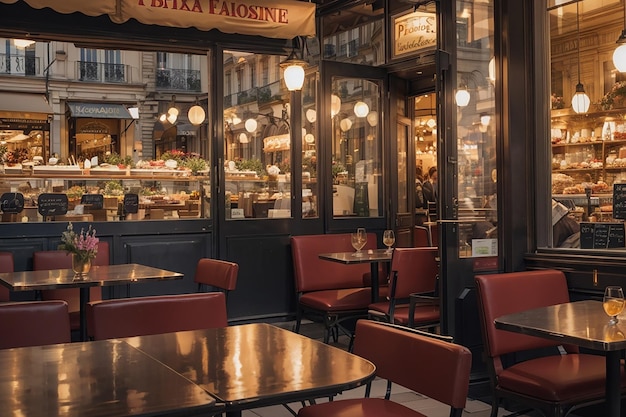
I want to click on seat, so click(x=424, y=361), click(x=503, y=297), click(x=412, y=272), click(x=314, y=256), click(x=218, y=274), click(x=193, y=301), click(x=39, y=319), click(x=46, y=260), click(x=3, y=267).